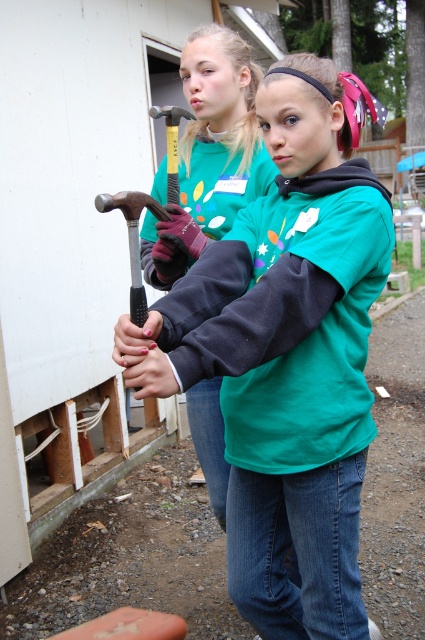
Question: Is green matte sweatshirt at center below matte black hammer at upper left?

Choices:
 (A) no
 (B) yes

Answer: (B)

Question: Is green matte sweatshirt at center behind matte black hammer at upper left?

Choices:
 (A) no
 (B) yes

Answer: (A)

Question: Is green matte sweatshirt at center to the left of matte black hammer at upper left from the viewer's perspective?

Choices:
 (A) no
 (B) yes

Answer: (A)

Question: Which object is farther from the camera taking this photo?

Choices:
 (A) matte black hammer at upper left
 (B) green matte sweatshirt at center

Answer: (A)